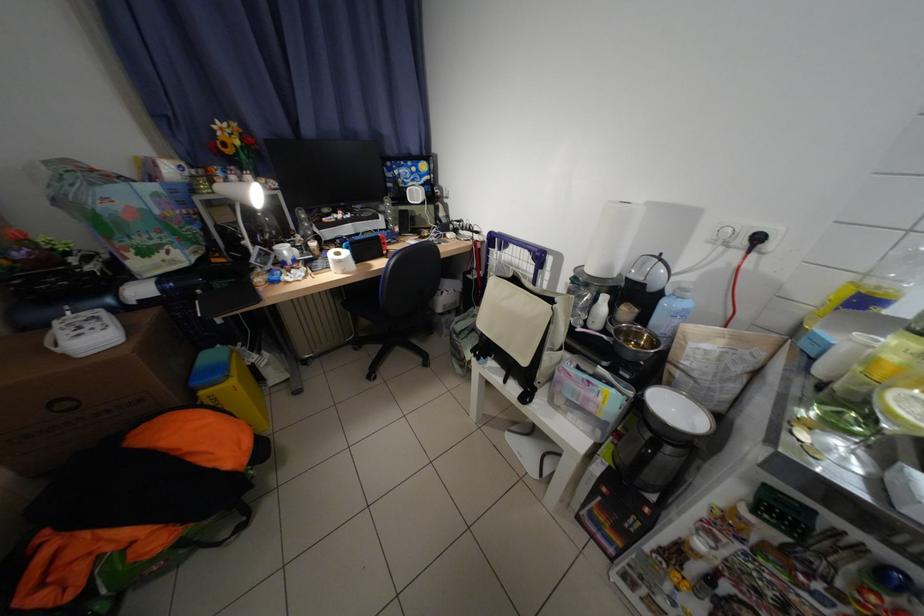
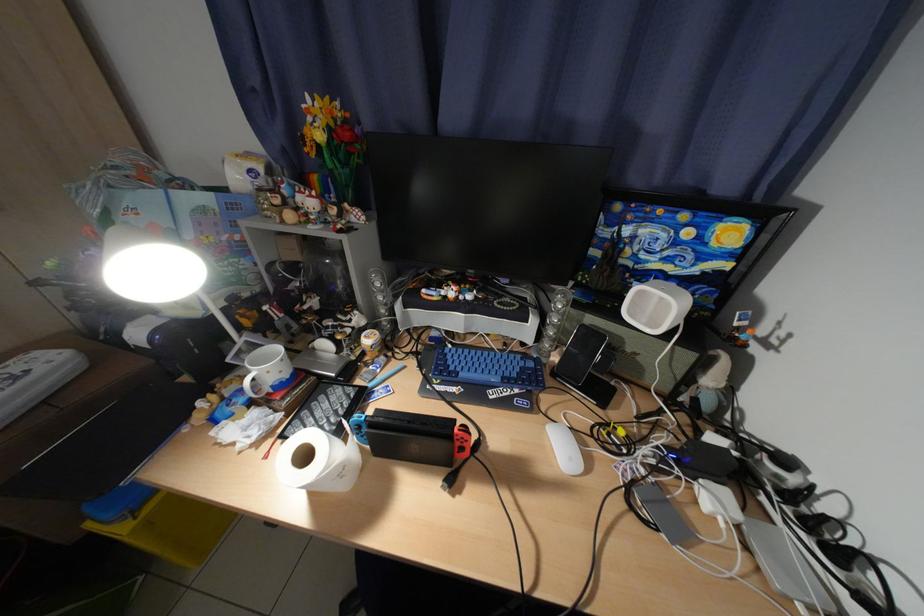
Locate, in the second image, the point that corresponds to [395,228] in the first image.

(541, 342)